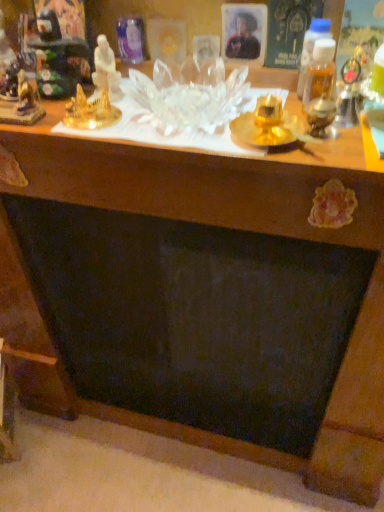
Question: Is transparent glass table at upper center a part of metallic gold figurine at upper left, the 3th toy from the right?

Choices:
 (A) yes
 (B) no

Answer: (B)

Question: From the image's perspective, is metallic gold figurine at upper left, which is the second toy in left-to-right order, on top of transparent glass table at upper center?

Choices:
 (A) yes
 (B) no

Answer: (A)

Question: From a real-world perspective, does metallic gold figurine at upper left, which is the second toy in left-to-right order, stand above transparent glass table at upper center?

Choices:
 (A) no
 (B) yes

Answer: (B)

Question: Does metallic gold figurine at upper left, which is the second toy in left-to-right order, have a greater height compared to transparent glass table at upper center?

Choices:
 (A) yes
 (B) no

Answer: (A)

Question: Is metallic gold figurine at upper left, which is the second toy in left-to-right order, facing towards transparent glass table at upper center?

Choices:
 (A) yes
 (B) no

Answer: (B)

Question: Can you confirm if metallic gold figurine at upper left, the 3th toy from the right, is smaller than transparent glass table at upper center?

Choices:
 (A) yes
 (B) no

Answer: (A)

Question: From a real-world perspective, is white porcelain statue at upper left, the 1th toy viewed from the right, physically below matte black portrait at upper center?

Choices:
 (A) yes
 (B) no

Answer: (A)

Question: Considering the relative sizes of white porcelain statue at upper left, the 1th toy viewed from the right, and matte black portrait at upper center in the image provided, is white porcelain statue at upper left, the 1th toy viewed from the right, wider than matte black portrait at upper center?

Choices:
 (A) no
 (B) yes

Answer: (B)

Question: Does white porcelain statue at upper left, placed as the 4th toy when sorted from left to right, turn towards matte black portrait at upper center?

Choices:
 (A) yes
 (B) no

Answer: (B)

Question: Considering the relative sizes of white porcelain statue at upper left, placed as the 4th toy when sorted from left to right, and matte black portrait at upper center in the image provided, is white porcelain statue at upper left, placed as the 4th toy when sorted from left to right, thinner than matte black portrait at upper center?

Choices:
 (A) no
 (B) yes

Answer: (A)

Question: Is the depth of white porcelain statue at upper left, the 1th toy viewed from the right, greater than that of matte black portrait at upper center?

Choices:
 (A) yes
 (B) no

Answer: (B)

Question: Considering the relative sizes of white porcelain statue at upper left, the 1th toy viewed from the right, and matte black portrait at upper center in the image provided, is white porcelain statue at upper left, the 1th toy viewed from the right, smaller than matte black portrait at upper center?

Choices:
 (A) no
 (B) yes

Answer: (A)

Question: Is gold metallic statue at upper left, the 3th toy in the left-to-right sequence, next to white porcelain statue at upper left, the 1th toy viewed from the right?

Choices:
 (A) no
 (B) yes

Answer: (B)